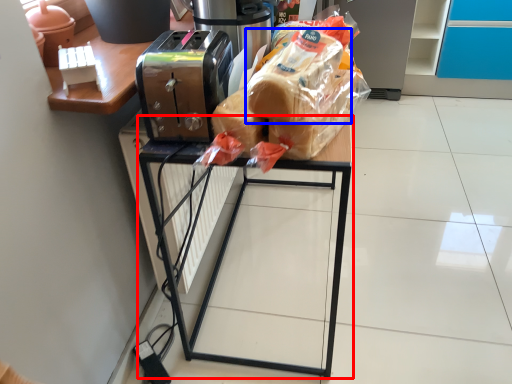
Question: Which object is closer to the camera taking this photo, furniture (highlighted by a red box) or bread (highlighted by a blue box)?

Choices:
 (A) furniture
 (B) bread

Answer: (B)